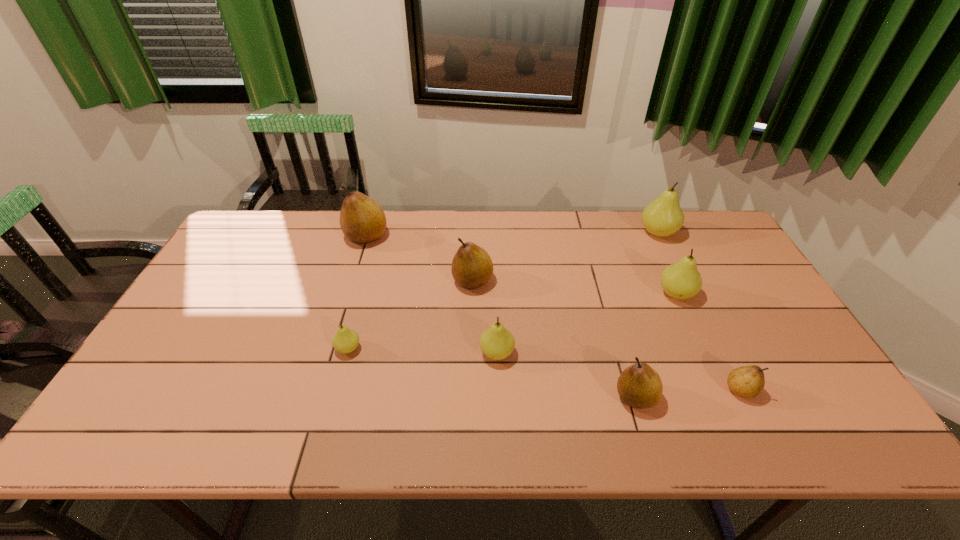
Where is `the farthest brown pear`? The width and height of the screenshot is (960, 540). the farthest brown pear is located at coordinates (362, 220).

Find the location of a particular element. The height and width of the screenshot is (540, 960). the leftmost brown pear is located at coordinates (362, 220).

Where is `the biggest green pear`? This screenshot has width=960, height=540. the biggest green pear is located at coordinates (662, 217).

Locate an element on the screen. This screenshot has height=540, width=960. the second biggest green pear is located at coordinates (681, 280).

At what (x,y) coordinates should I click in order to perform the action: click on the third nearest brown pear. Please return your answer as a coordinate pair (x, y). The image size is (960, 540). Looking at the image, I should click on (472, 267).

This screenshot has width=960, height=540. What are the coordinates of `the third smallest brown pear` in the screenshot? It's located at (472, 267).

Where is `the third biggest green pear`? This screenshot has width=960, height=540. the third biggest green pear is located at coordinates (497, 343).

The image size is (960, 540). Identify the location of the second smallest brown pear. (639, 386).

Identify the location of the third brown pear from left to right. Image resolution: width=960 pixels, height=540 pixels. (639, 386).

In order to click on the leftmost green pear in this screenshot , I will do `click(345, 340)`.